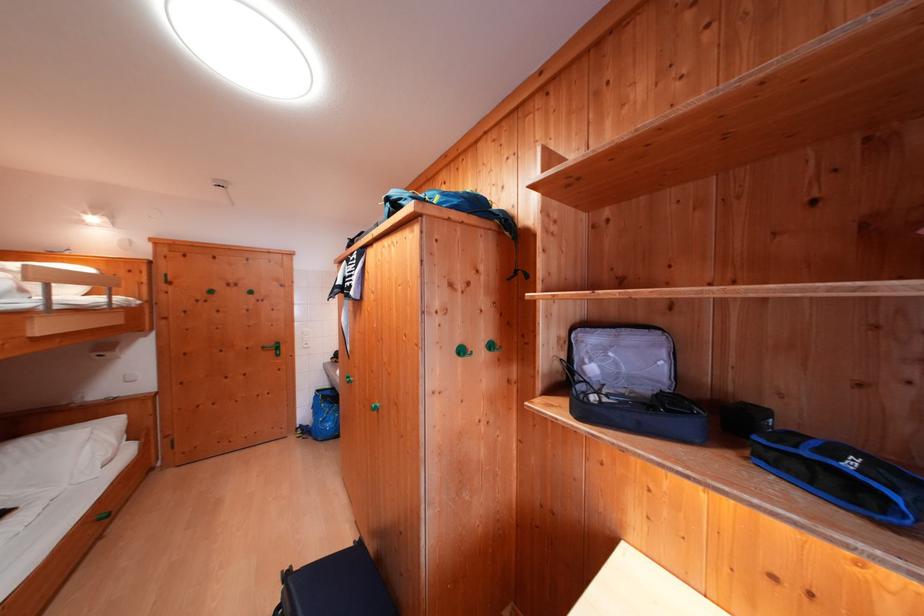
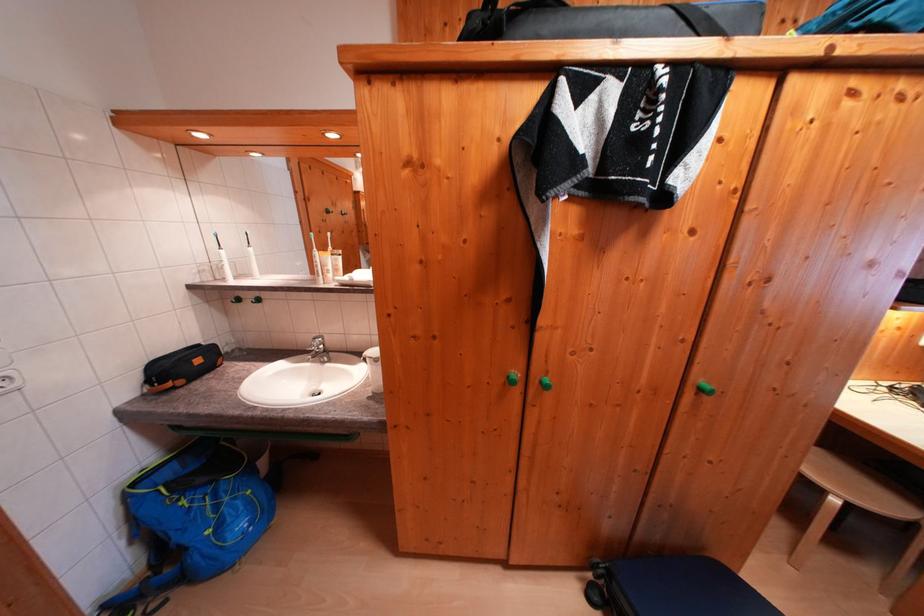
The point at (326, 395) is marked in the first image. Where is the corresponding point in the second image?

(142, 488)